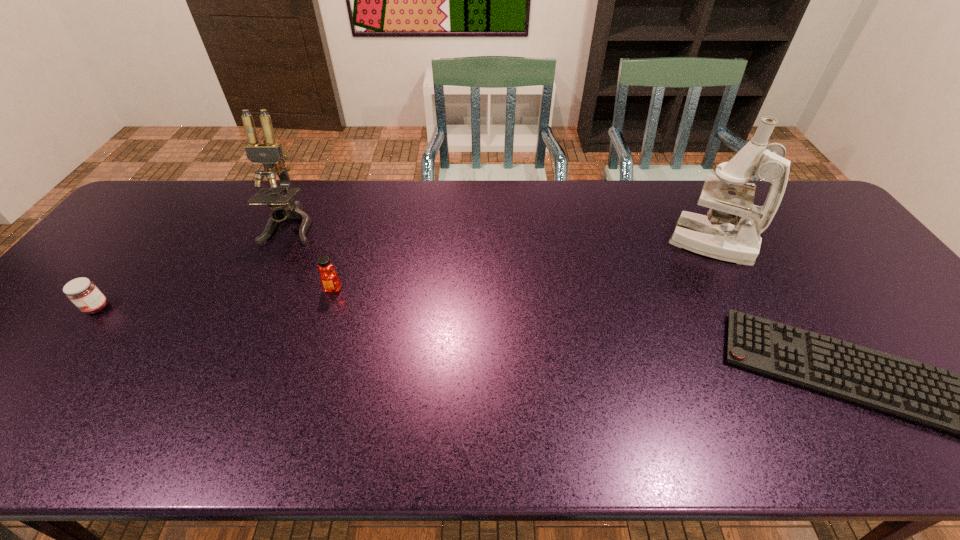
Locate an element on the screen. object at the left edge is located at coordinates (83, 293).

The width and height of the screenshot is (960, 540). In order to click on vacant space at the far edge of the desktop in this screenshot , I will do `click(618, 222)`.

At what (x,y) coordinates should I click in order to perform the action: click on vacant region at the near edge. Please return your answer as a coordinate pair (x, y). This screenshot has width=960, height=540. Looking at the image, I should click on (895, 418).

The image size is (960, 540). Identify the location of free space at the right edge. (929, 347).

This screenshot has width=960, height=540. Find the location of `free space between the right microscope and the jam`. free space between the right microscope and the jam is located at coordinates (403, 275).

The width and height of the screenshot is (960, 540). Identify the location of free point between the left microscope and the leftmost object. (194, 266).

Where is `free space between the fourth tallest object and the third tallest object`? The image size is (960, 540). free space between the fourth tallest object and the third tallest object is located at coordinates (215, 298).

You are a GUI agent. You are given a task and a screenshot of the screen. Output one action in this format:
    pyautogui.click(x=<x>, y=<y>)
    Task: Click on the vacant area that lies between the left microscope and the jam
    The height and width of the screenshot is (540, 960).
    Given the screenshot: What is the action you would take?
    pyautogui.click(x=194, y=266)

You are a GUI agent. You are given a task and a screenshot of the screen. Output one action in this format:
    pyautogui.click(x=<x>, y=<y>)
    Task: Click on the vacant area that lies between the fourth tallest object and the second object from left to right
    
    Given the screenshot: What is the action you would take?
    pyautogui.click(x=194, y=266)

Identify the location of free space between the left microscope and the leftmost object. The image size is (960, 540). (194, 266).